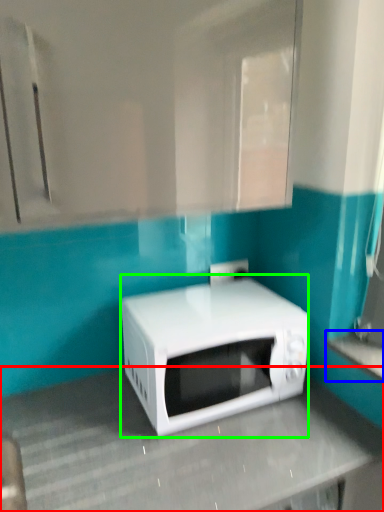
Question: Based on their relative distances, which object is farther from counter top (highlighted by a red box)? Choose from counter top (highlighted by a blue box) and microwave oven (highlighted by a green box).

Choices:
 (A) counter top
 (B) microwave oven

Answer: (A)